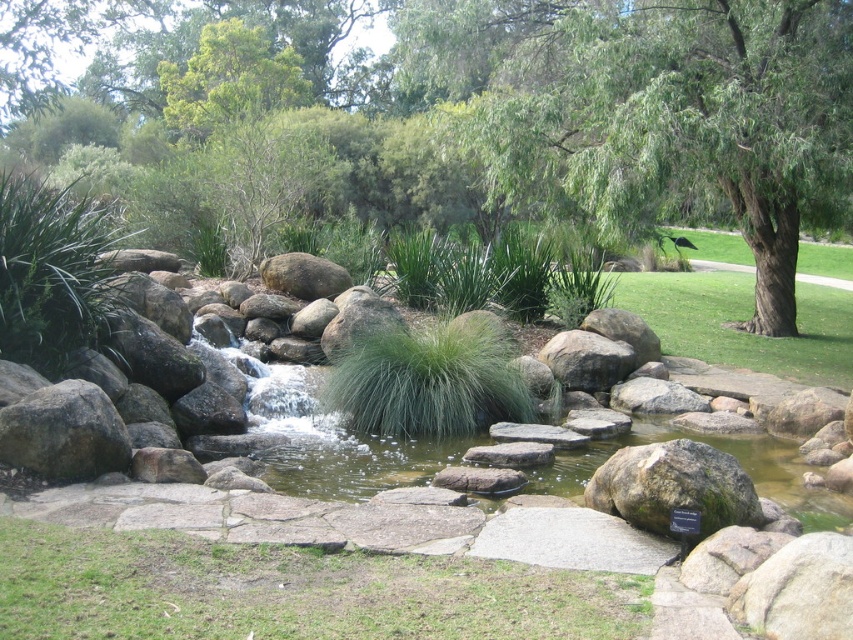
Between green mossy rock at lower right and rough textured rock at center, which one appears on the left side from the viewer's perspective?

Positioned to the left is green mossy rock at lower right.

Who is shorter, green mossy rock at lower right or rough textured rock at center?

Standing shorter between the two is green mossy rock at lower right.

Who is more forward, (722, 506) or (561, 378)?

Point (722, 506) is in front.

This screenshot has width=853, height=640. I want to click on green mossy rock at lower right, so click(674, 486).

Is green leafy tree at upper center above rough textured rock at center?

Yes, green leafy tree at upper center is above rough textured rock at center.

This screenshot has height=640, width=853. In order to click on green leafy tree at upper center in this screenshot , I will do `click(230, 80)`.

This screenshot has height=640, width=853. Identify the location of green leafy tree at upper center. (230, 80).

Does point (480, 387) lie behind point (227, 49)?

That is False.

The height and width of the screenshot is (640, 853). What do you see at coordinates (430, 380) in the screenshot?
I see `green fuzzy grass at center` at bounding box center [430, 380].

Is point (381, 369) less distant than point (184, 97)?

Yes, point (381, 369) is in front of point (184, 97).

This screenshot has height=640, width=853. Identify the location of green fuzzy grass at center. (430, 380).